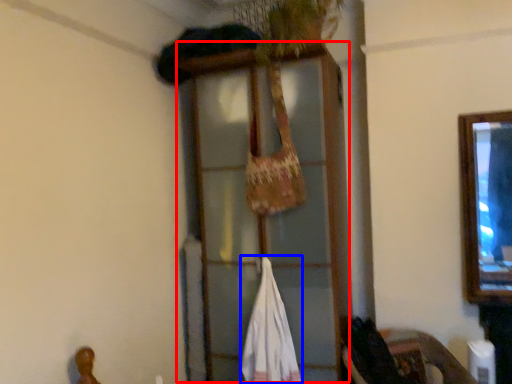
Question: Which of the following is the closest to the observer, window frame (highlighted by a red box) or wide (highlighted by a blue box)?

Choices:
 (A) window frame
 (B) wide

Answer: (A)